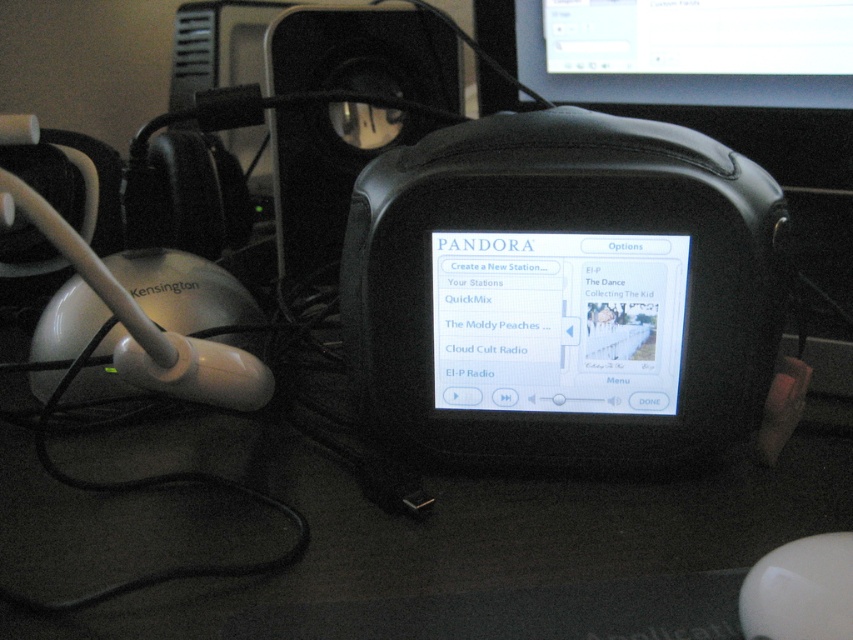
Question: Which object appears farthest from the camera in this image?

Choices:
 (A) black plastic speaker at center
 (B) matte black monitor at upper center
 (C) white glossy mouse at lower right
 (D) matte black screen at center

Answer: (A)

Question: Which object is the closest to the white glossy mouse at lower right?

Choices:
 (A) black plastic speaker at center
 (B) matte black monitor at upper center
 (C) matte black screen at center

Answer: (C)

Question: Observing the image, what is the correct spatial positioning of matte black screen at center in reference to white glossy mouse at lower right?

Choices:
 (A) above
 (B) below

Answer: (A)

Question: Which point is farther from the camera taking this photo?

Choices:
 (A) (265, 51)
 (B) (601, 276)
 (C) (810, 86)

Answer: (A)

Question: Does matte black monitor at upper center appear under black plastic speaker at center?

Choices:
 (A) no
 (B) yes

Answer: (A)

Question: Can you confirm if matte black screen at center is positioned to the left of black plastic speaker at center?

Choices:
 (A) yes
 (B) no

Answer: (B)